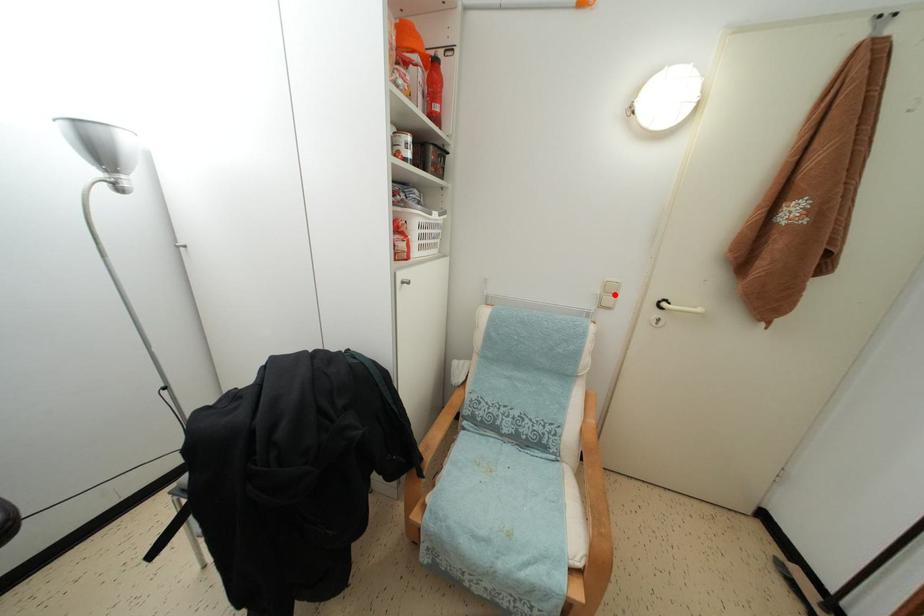
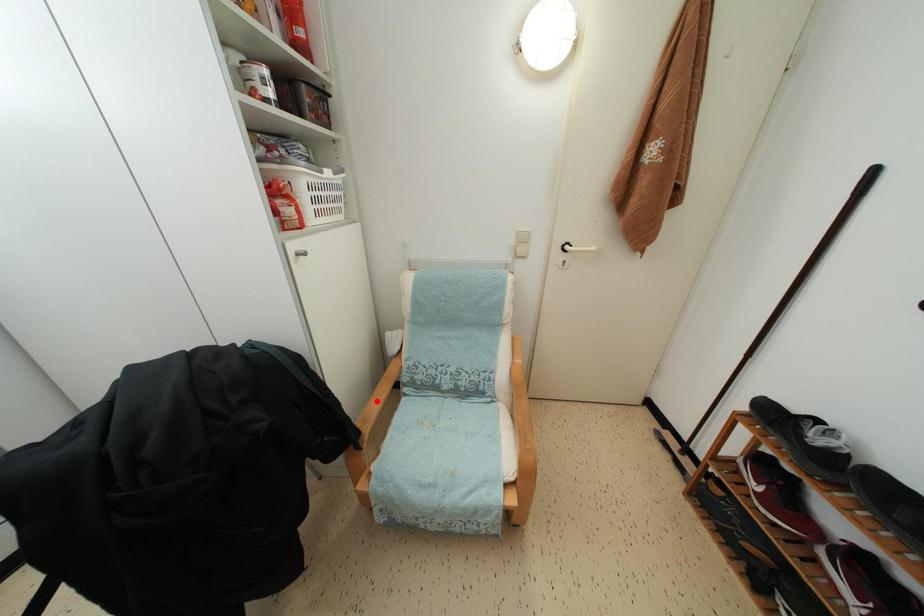
I am providing you with two images of the same scene from different viewpoints. A red point is marked on the first image and another point is marked on the second image. Do the highlighted points in image1 and image2 indicate the same real-world spot?

No